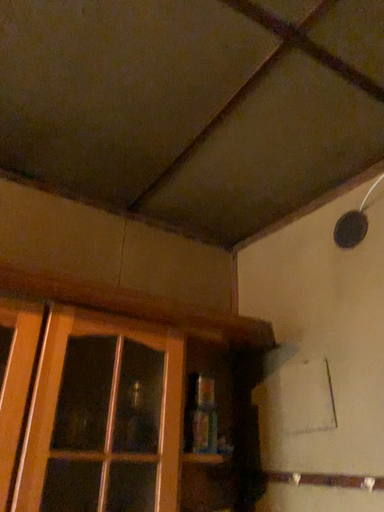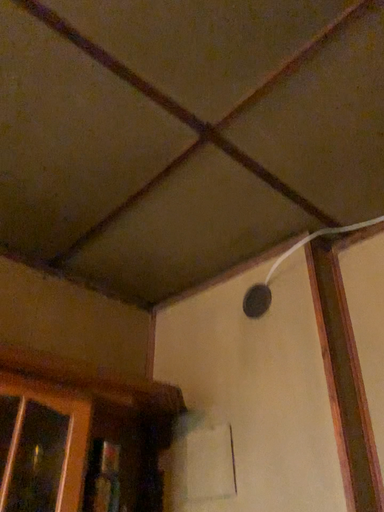
Question: How did the camera likely rotate when shooting the video?

Choices:
 (A) rotated right
 (B) rotated left

Answer: (A)